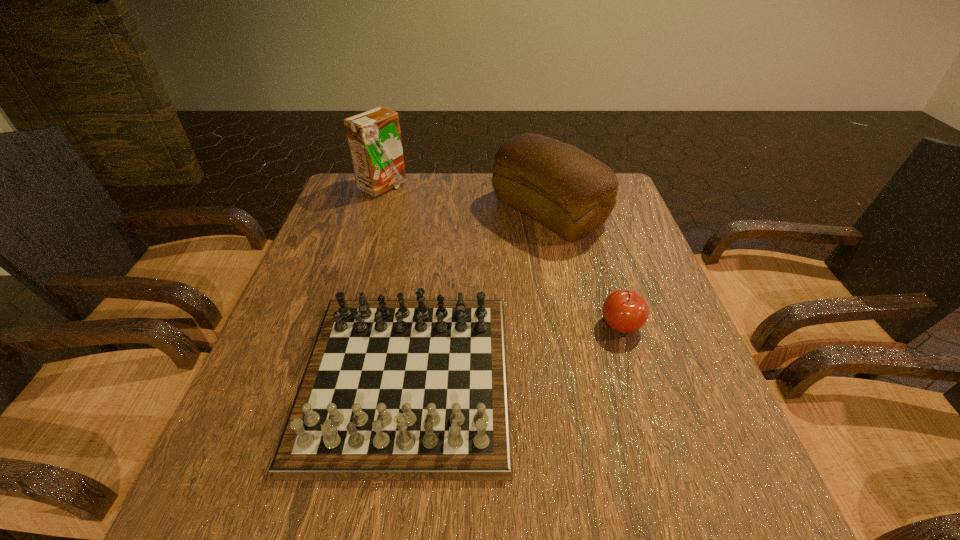
Identify the location of carton. This screenshot has height=540, width=960. (374, 138).

The image size is (960, 540). Find the location of `bread`. bread is located at coordinates (570, 192).

Find the location of a particular element. The width and height of the screenshot is (960, 540). apple is located at coordinates (625, 311).

At what (x,y) coordinates should I click in order to perform the action: click on chessboard. Please return your answer as a coordinate pair (x, y). This screenshot has height=540, width=960. Looking at the image, I should click on (394, 390).

Where is `free space located 0.350m on the straw side of the carton`? The height and width of the screenshot is (540, 960). free space located 0.350m on the straw side of the carton is located at coordinates coord(518,187).

The height and width of the screenshot is (540, 960). Find the location of `free location located on the front of the bread`. free location located on the front of the bread is located at coordinates (569, 309).

Identify the location of free region located 0.380m on the left of the apple. Image resolution: width=960 pixels, height=540 pixels. (423, 325).

Locate an element on the screen. This screenshot has height=540, width=960. free space located 0.060m from the player's perspective of the chessboard is located at coordinates point(385,521).

Locate an element on the screen. The image size is (960, 540). carton that is positioned at the far edge is located at coordinates (374, 138).

Where is `bread located at the far edge`? The image size is (960, 540). bread located at the far edge is located at coordinates (570, 192).